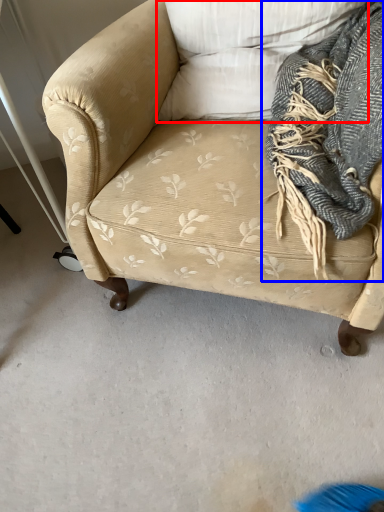
Question: Which point is closer to the camera, pillow (highlighted by a red box) or scarf (highlighted by a blue box)?

Choices:
 (A) pillow
 (B) scarf

Answer: (B)